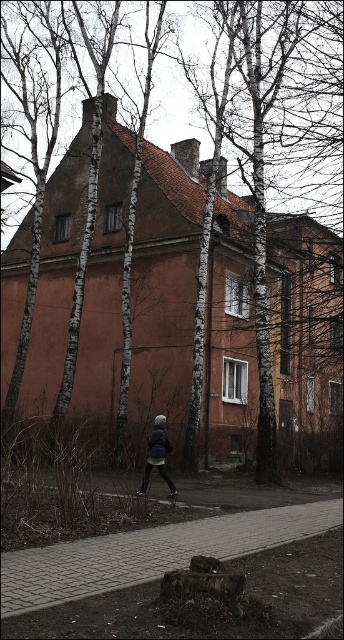
Question: Which of the following is the farthest from the observer?

Choices:
 (A) dark blue fabric jacket at center
 (B) white bark tree at center

Answer: (B)

Question: In this image, where is white bark tree at center located relative to dark blue fabric jacket at center?

Choices:
 (A) below
 (B) above

Answer: (B)

Question: Which point appears closest to the camera in this image?

Choices:
 (A) pyautogui.click(x=158, y=472)
 (B) pyautogui.click(x=323, y=525)
 (C) pyautogui.click(x=95, y=376)

Answer: (B)

Question: Estimate the real-world distances between objects in this image. Which object is closer to the white bark tree at center?

Choices:
 (A) paved brick sidewalk at center
 (B) dark blue fabric jacket at center

Answer: (B)

Question: Is white bark tree at center above dark blue fabric jacket at center?

Choices:
 (A) no
 (B) yes

Answer: (B)

Question: Does white bark tree at center appear under paved brick sidewalk at center?

Choices:
 (A) no
 (B) yes

Answer: (A)